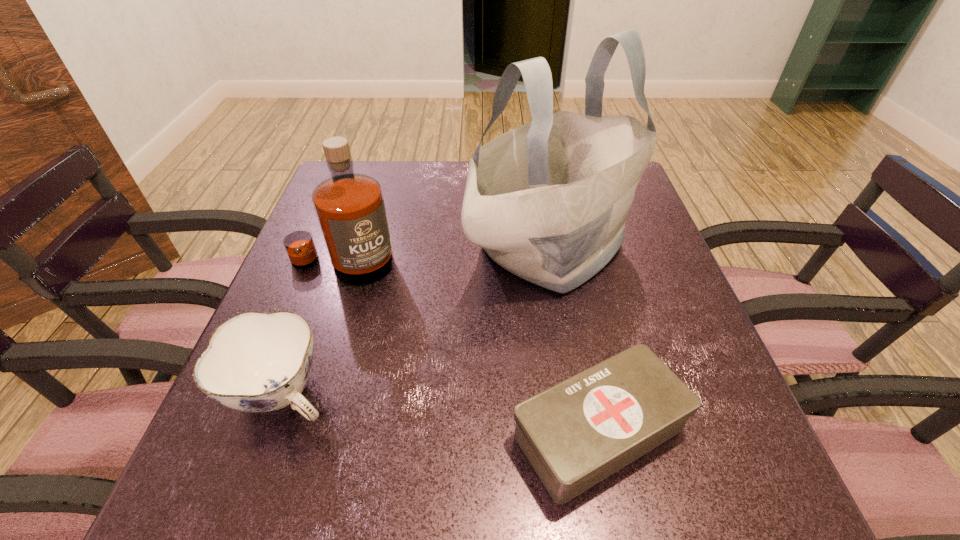
Find the location of a particular element. This screenshot has height=540, width=960. the tallest object is located at coordinates (547, 201).

The height and width of the screenshot is (540, 960). I want to click on liquor, so click(350, 208).

Where is `the third tallest object`? This screenshot has width=960, height=540. the third tallest object is located at coordinates (256, 361).

At what (x,y) coordinates should I click in order to perform the action: click on the shortest object. Please return your answer as a coordinate pair (x, y). The image size is (960, 540). Looking at the image, I should click on (575, 434).

This screenshot has width=960, height=540. In order to click on vacant space located 0.170m on the front of the shopping bag in this screenshot , I will do `click(575, 375)`.

Find the location of a particular element. The width and height of the screenshot is (960, 540). vacant point located on the front label of the liquor is located at coordinates (292, 416).

Where is `vacant space located 0.370m on the right of the third tallest object`? The height and width of the screenshot is (540, 960). vacant space located 0.370m on the right of the third tallest object is located at coordinates (559, 394).

Locate an element on the screen. The height and width of the screenshot is (540, 960). vacant space located 0.090m on the right of the first-aid kit is located at coordinates (742, 431).

The height and width of the screenshot is (540, 960). What are the coordinates of `object located in the far edge section of the desktop` in the screenshot? It's located at (547, 201).

This screenshot has width=960, height=540. In order to click on object that is at the near edge in this screenshot , I will do `click(575, 434)`.